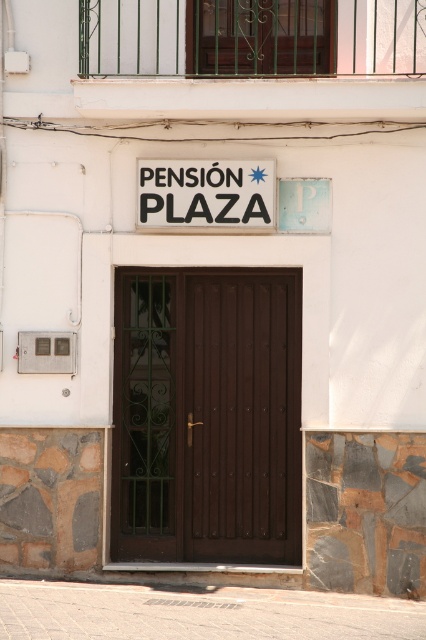
You are a delivery person trying to attach a package label to the sign. Since the green wrought iron gate at upper center and the matte plastic sign at center are both visible from the street, which object would you target to ensure the label is easily seen by guests arriving at the entrance?

The green wrought iron gate at upper center has a larger size compared to the matte plastic sign at center, so attaching the package label to the green wrought iron gate at upper center would make it more visible to guests arriving at the entrance.

You are a delivery person trying to deliver a package to the address at the PENSI?N PLAZA. You see the green wrought iron gate at upper center and the matte plastic sign at center. Which object is taller?

The green wrought iron gate at upper center is much taller than the matte plastic sign at center.

You are standing at the entrance of PENSiON PLAZA and want to locate the green wrought iron gate at upper center. According to the coordinates provided, where exactly is it positioned?

The green wrought iron gate at upper center is located at point coordinates of 0.058 on the x axis and 0.610 on the y axis.